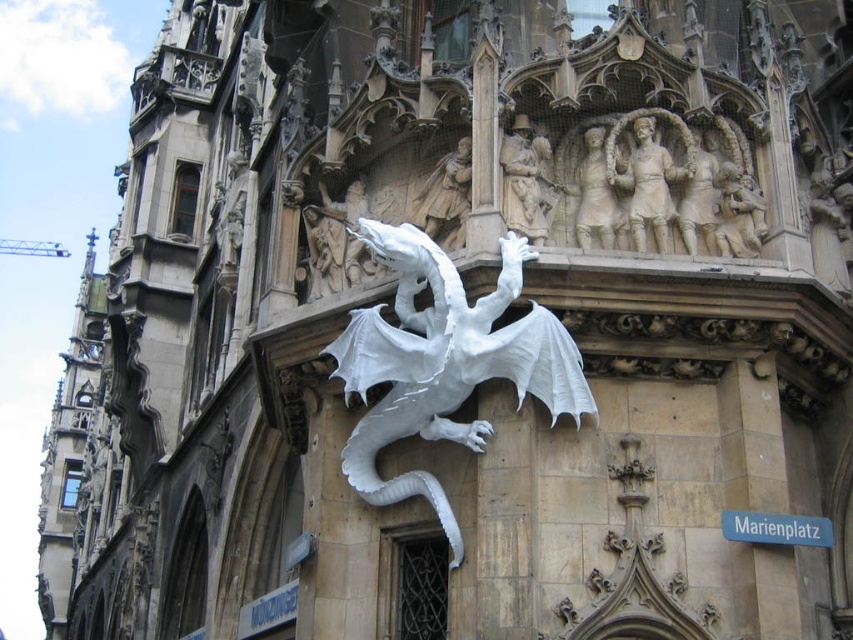
You are an architect inspecting the building facade. You notice two elements at the upper center of the structure. Which one is narrower between the sculpted stone figures at upper center and the white stone relief at upper center?

The sculpted stone figures at upper center has a lesser width compared to the white stone relief at upper center, so the sculpted stone figures at upper center is narrower.

You are an architect examining the building facade. You notice the sculpted stone figures at upper center. Where exactly are these figures positioned relative to the building structure?

The sculpted stone figures at upper center are located at coordinates point (648, 176) on the building facade.

In the scene shown: You are a maintenance worker tasked with inspecting the white stone dragon at center and the white stone relief at upper center. The safety regulations state that you must stay at least 5 meters away from any edge to avoid falling. Given the distance between them, can you safely move from one to the other without violating the safety rule?

The distance between the white stone dragon at center and the white stone relief at upper center is 6.51 meters. Since the safety regulation requires staying at least 5 meters away from any edge, the 6.51 meters distance allows you to move between them while maintaining the required safety distance.